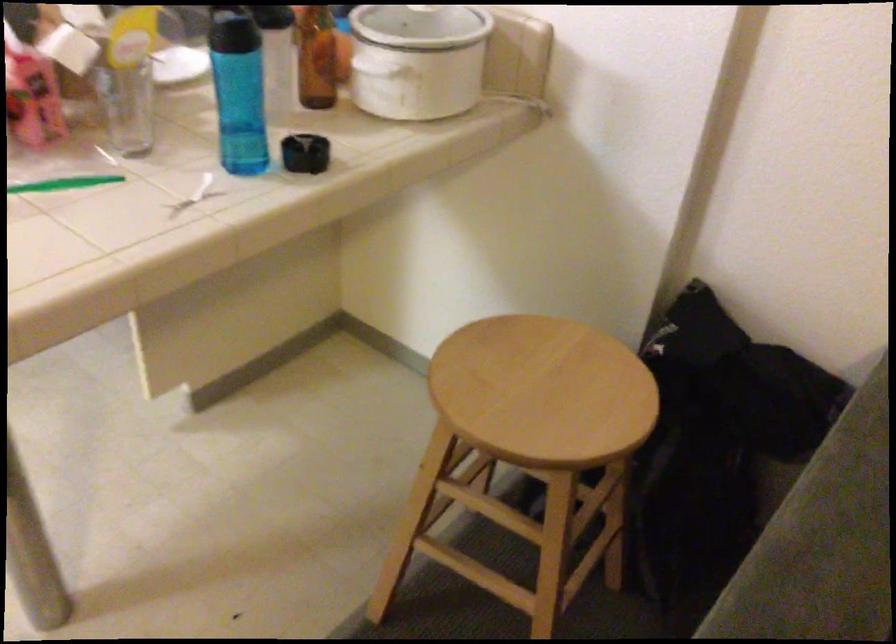
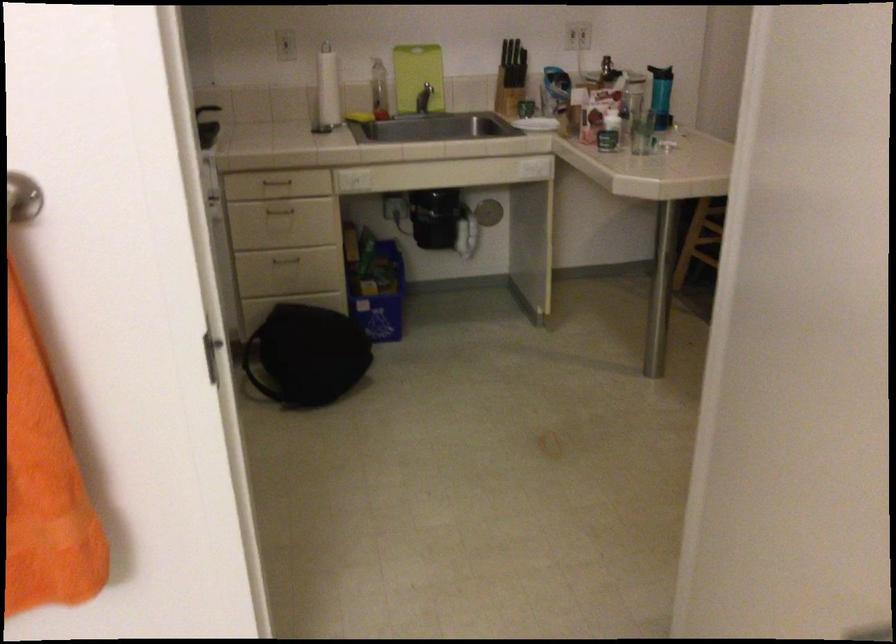
Question: I am providing you with two images of the same scene from different viewpoints. Please identify which objects are invisible in image2.

Choices:
 (A) drawer handle
 (B) clear drinking glass
 (C) white webcam
 (D) wooden stool seat

Answer: (D)